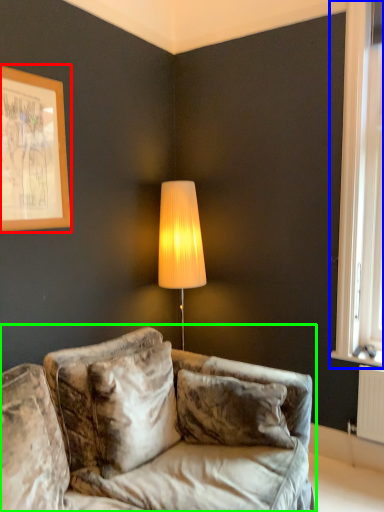
Question: Based on their relative distances, which object is nearer to picture frame (highlighted by a red box)? Choose from window (highlighted by a blue box) and studio couch (highlighted by a green box).

Choices:
 (A) window
 (B) studio couch

Answer: (B)